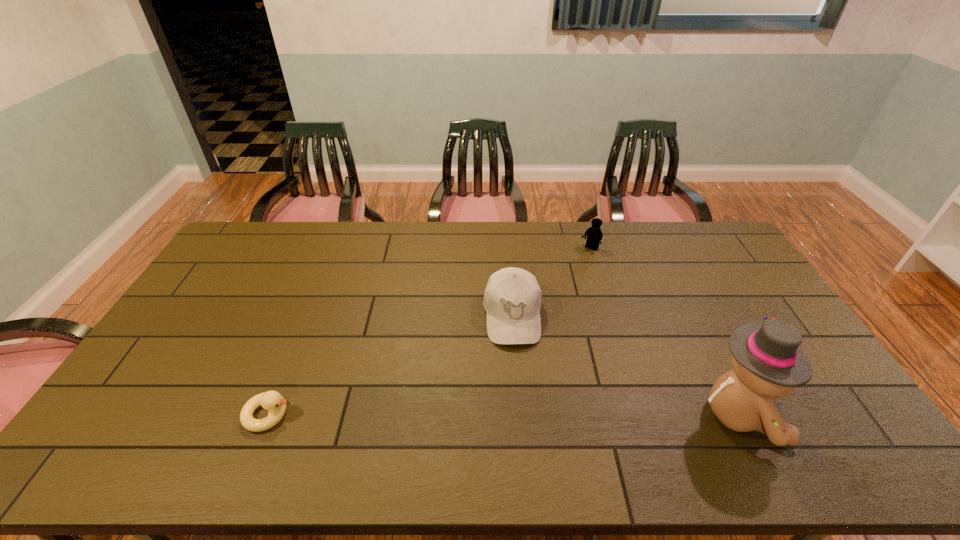
Where is `vacant region between the third object from right to left and the duckling`? The image size is (960, 540). vacant region between the third object from right to left and the duckling is located at coordinates (391, 365).

Image resolution: width=960 pixels, height=540 pixels. In order to click on unoccupied position between the Lego and the rag_doll in this screenshot , I will do `click(665, 332)`.

Where is `free space between the leftmost object and the farthest object`? Image resolution: width=960 pixels, height=540 pixels. free space between the leftmost object and the farthest object is located at coordinates (x=429, y=332).

At what (x,y) coordinates should I click in order to perform the action: click on object identified as the second closest to the second object from right to left. Please return your answer as a coordinate pair (x, y). Looking at the image, I should click on (768, 362).

Identify the location of the closest object to the rag_doll. pos(512,299).

Locate an element on the screen. vacant space that satisfies the following two spatial constraints: 1. on the front side of the baseball cap; 2. on the front-facing side of the rag_doll is located at coordinates (520, 415).

Where is `vacant space that satisfies the following two spatial constraints: 1. on the back side of the third nearest object; 2. on the left side of the Lego`? vacant space that satisfies the following two spatial constraints: 1. on the back side of the third nearest object; 2. on the left side of the Lego is located at coordinates (507, 249).

The height and width of the screenshot is (540, 960). I want to click on vacant area that satisfies the following two spatial constraints: 1. on the front side of the tallest object; 2. on the front-facing side of the Lego, so click(641, 415).